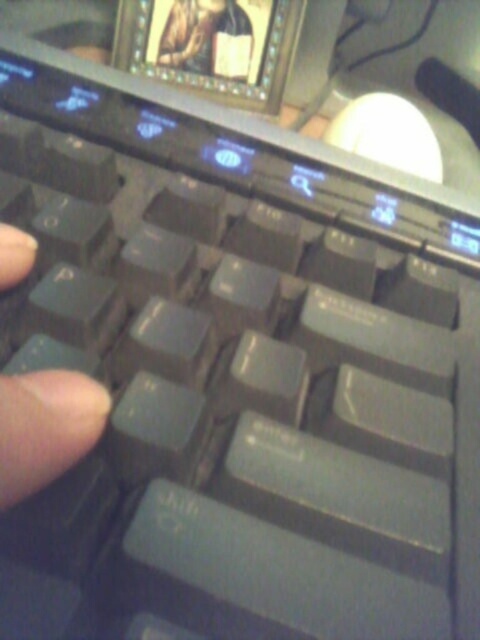
Which of these two, flesh-toned skin at center or white glossy mouse at upper center, stands taller?

Standing taller between the two is white glossy mouse at upper center.

What do you see at coordinates (46, 428) in the screenshot? The image size is (480, 640). I see `flesh-toned skin at center` at bounding box center [46, 428].

The height and width of the screenshot is (640, 480). Find the location of `flesh-toned skin at center`. flesh-toned skin at center is located at coordinates (46, 428).

Which of these two, flesh-toned skin at center or wooden carved statue at upper center, stands shorter?

wooden carved statue at upper center

Who is lower down, flesh-toned skin at center or wooden carved statue at upper center?

Positioned lower is flesh-toned skin at center.

Which is in front, point (21, 417) or point (247, 33)?

Point (21, 417)

This screenshot has height=640, width=480. I want to click on flesh-toned skin at center, so click(46, 428).

Can you confirm if white glossy mouse at upper center is thinner than wooden carved statue at upper center?

No, white glossy mouse at upper center is not thinner than wooden carved statue at upper center.

From the picture: Who is lower down, white glossy mouse at upper center or wooden carved statue at upper center?

white glossy mouse at upper center is lower down.

You are a GUI agent. You are given a task and a screenshot of the screen. Output one action in this format:
    pyautogui.click(x=<x>, y=<y>)
    Task: Click on the white glossy mouse at upper center
    Image resolution: width=480 pixels, height=640 pixels.
    Given the screenshot: What is the action you would take?
    pyautogui.click(x=387, y=134)